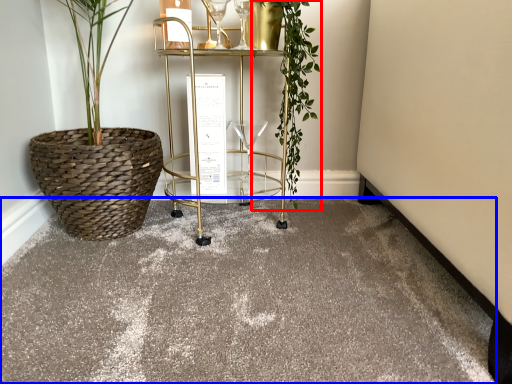
Question: Which point is further to the camera, vegetation (highlighted by a red box) or concrete (highlighted by a blue box)?

Choices:
 (A) vegetation
 (B) concrete

Answer: (A)